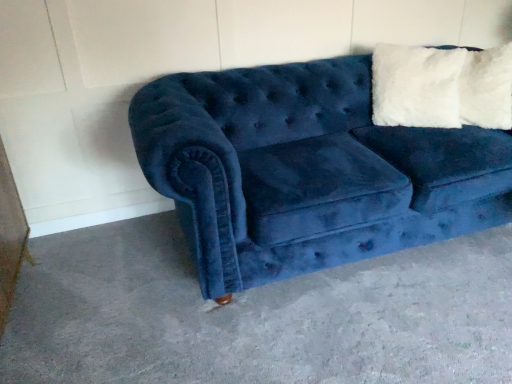
The height and width of the screenshot is (384, 512). I want to click on velvet blue couch at center, so click(307, 171).

The height and width of the screenshot is (384, 512). What do you see at coordinates (307, 171) in the screenshot?
I see `velvet blue couch at center` at bounding box center [307, 171].

Image resolution: width=512 pixels, height=384 pixels. What do you see at coordinates (257, 315) in the screenshot?
I see `blue velvet couch at lower right` at bounding box center [257, 315].

Locate an element on the screen. blue velvet couch at lower right is located at coordinates (257, 315).

In order to face blue velvet couch at lower right, should I rotate leftwards or rightwards?

You should look right and rotate roughly 4.696 degrees.

I want to click on velvet blue couch at center, so click(307, 171).

Would you say blue velvet couch at lower right is to the left or to the right of velvet blue couch at center in the picture?

blue velvet couch at lower right is to the left of velvet blue couch at center.

Is the position of blue velvet couch at lower right less distant than that of velvet blue couch at center?

Yes, blue velvet couch at lower right is in front of velvet blue couch at center.

Which is nearer, (x=498, y=382) or (x=394, y=212)?

The point (x=498, y=382) is more forward.

From the image's perspective, would you say blue velvet couch at lower right is shown under velvet blue couch at center?

Indeed, from the image's perspective, blue velvet couch at lower right is shown beneath velvet blue couch at center.

From a real-world perspective, is blue velvet couch at lower right physically above velvet blue couch at center?

No.

Between blue velvet couch at lower right and velvet blue couch at center, which one has larger width?

With larger width is blue velvet couch at lower right.

Between blue velvet couch at lower right and velvet blue couch at center, which one has less height?

blue velvet couch at lower right is shorter.

Which of these two, blue velvet couch at lower right or velvet blue couch at center, is smaller?

blue velvet couch at lower right.

Is velvet blue couch at center inside blue velvet couch at lower right?

No, blue velvet couch at lower right does not contain velvet blue couch at center.

Are blue velvet couch at lower right and velvet blue couch at center making contact?

No, blue velvet couch at lower right is not next to velvet blue couch at center.

Is blue velvet couch at lower right aimed at velvet blue couch at center?

No.

Locate an element on the screen. studio couch that is above the blue velvet couch at lower right (from the image's perspective) is located at coordinates (307, 171).

Consider the image. Considering the positions of objects velvet blue couch at center and blue velvet couch at lower right in the image provided, who is more to the right, velvet blue couch at center or blue velvet couch at lower right?

velvet blue couch at center is more to the right.

Considering the positions of objects velvet blue couch at center and blue velvet couch at lower right in the image provided, who is behind, velvet blue couch at center or blue velvet couch at lower right?

velvet blue couch at center is behind.

Which is behind, point (345, 148) or point (138, 345)?

The point (345, 148) is farther from the camera.

Based on the photo, from the image's perspective, between velvet blue couch at center and blue velvet couch at lower right, who is located below?

blue velvet couch at lower right, from the image's perspective.

From a real-world perspective, which object stands above the other?

velvet blue couch at center is physically above.

Which object is thinner, velvet blue couch at center or blue velvet couch at lower right?

With smaller width is velvet blue couch at center.

In terms of height, does velvet blue couch at center look taller or shorter compared to blue velvet couch at lower right?

In the image, velvet blue couch at center appears to be taller than blue velvet couch at lower right.

Considering the relative sizes of velvet blue couch at center and blue velvet couch at lower right in the image provided, is velvet blue couch at center smaller than blue velvet couch at lower right?

Incorrect, velvet blue couch at center is not smaller in size than blue velvet couch at lower right.

Is velvet blue couch at center inside or outside of blue velvet couch at lower right?

The correct answer is: outside.

Is the surface of velvet blue couch at center in direct contact with blue velvet couch at lower right?

velvet blue couch at center and blue velvet couch at lower right are clearly separated.

Is velvet blue couch at center positioned with its back to blue velvet couch at lower right?

No.

Where is `concrete on the left of velvet blue couch at center`? The width and height of the screenshot is (512, 384). concrete on the left of velvet blue couch at center is located at coordinates (257, 315).

In the image, there is a velvet blue couch at center. In order to click on concrete below it (from a real-world perspective) in this screenshot , I will do `click(257, 315)`.

Identify the location of concrete on the left of velvet blue couch at center. Image resolution: width=512 pixels, height=384 pixels. (257, 315).